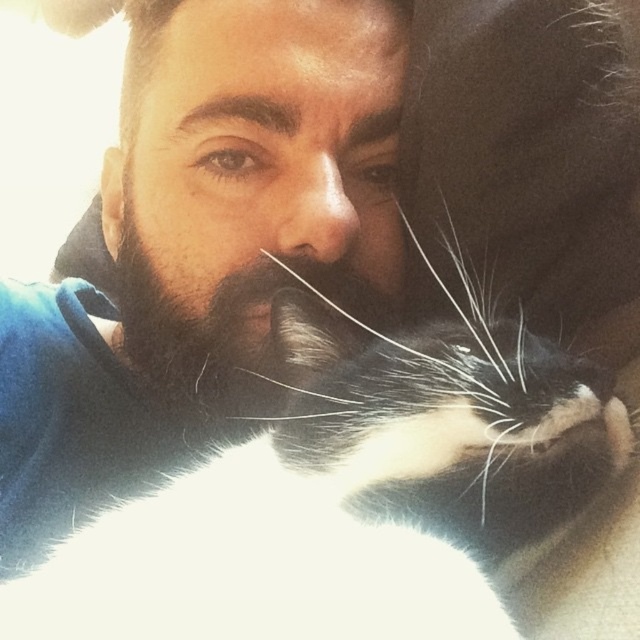
Looking at this image, you are a photographer trying to capture the interaction between the white fur cat at center and the black fuzzy beard at center. Which object is located to the left of the other?

The white fur cat at center is positioned on the left side of black fuzzy beard at center.

You are a photographer standing in front of the man and the white fur cat at center. You want to take a photo of the cat without disturbing them. Since the camera requires a minimum distance of 20 inches to focus properly, will you be able to take a clear photo from your current position?

The white fur cat at center and viewer are 19.16 inches apart, which is less than the required 20 inches for the camera to focus properly. Therefore, you need to move back slightly to ensure a clear photo.

You are a photographer adjusting your camera focus. You notice two points in the frame at coordinates point (x=58, y=550) and point (x=216, y=330). Which point should you focus on first if you want to ensure the closest object is sharp?

Point (x=58, y=550) is closer to the viewer than point (x=216, y=330), so you should focus on point (x=58, y=550) first to ensure the closest object is sharp.